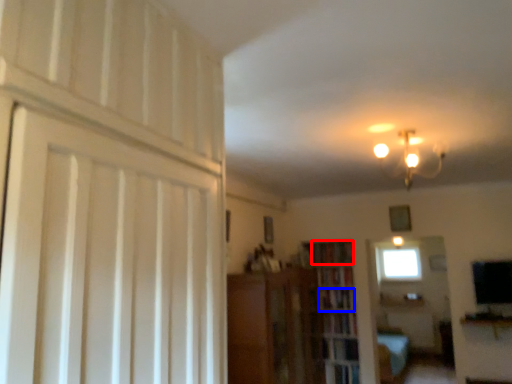
Question: Among these objects, which one is nearest to the camera, book (highlighted by a red box) or book (highlighted by a blue box)?

Choices:
 (A) book
 (B) book

Answer: (B)